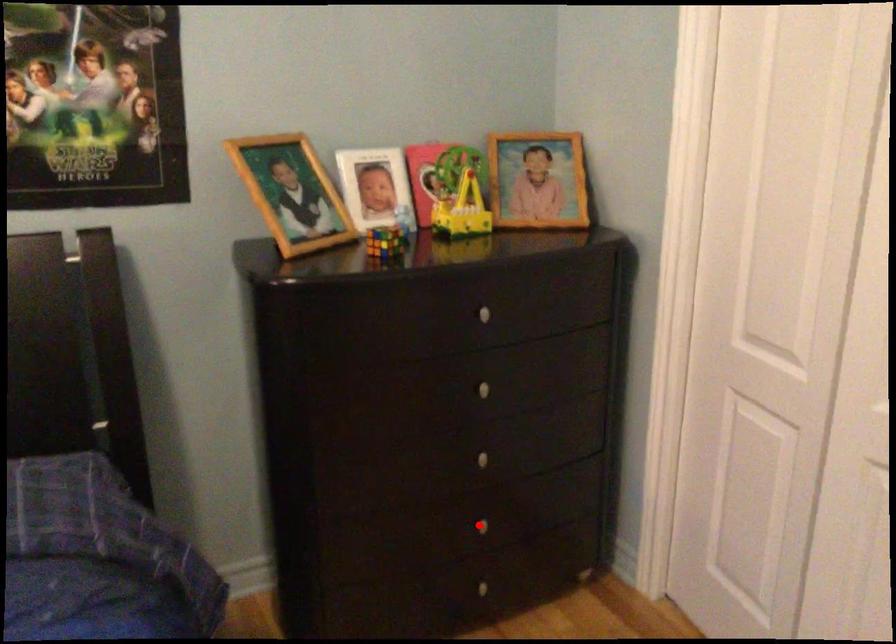
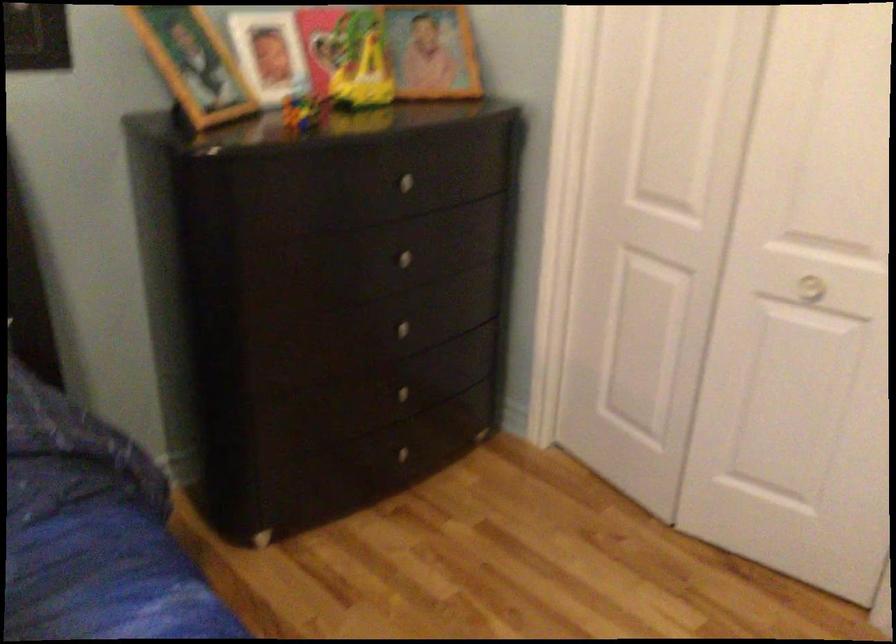
In the second image, find the point that corresponds to the highlighted location in the first image.

(400, 393)